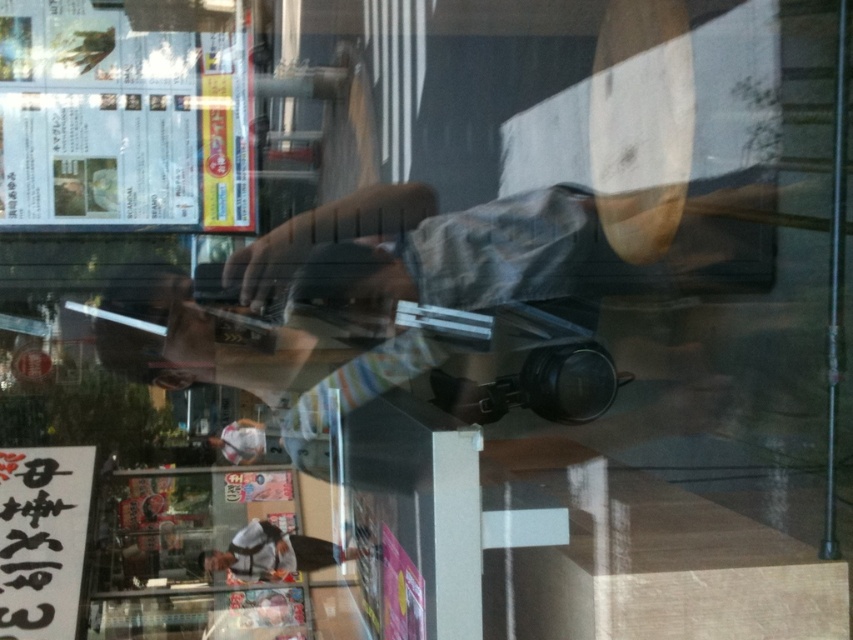
Question: Which point is closer to the camera?

Choices:
 (A) white plastic bag at lower center
 (B) gray fabric shirt at center

Answer: (B)

Question: Is gray fabric shirt at center thinner than white plastic bag at lower center?

Choices:
 (A) no
 (B) yes

Answer: (A)

Question: Among these objects, which one is farthest from the camera?

Choices:
 (A) white plastic bag at lower center
 (B) gray fabric shirt at center

Answer: (A)

Question: Is gray fabric shirt at center above white plastic bag at lower center?

Choices:
 (A) yes
 (B) no

Answer: (A)

Question: Can you confirm if gray fabric shirt at center is positioned to the left of white plastic bag at lower center?

Choices:
 (A) no
 (B) yes

Answer: (A)